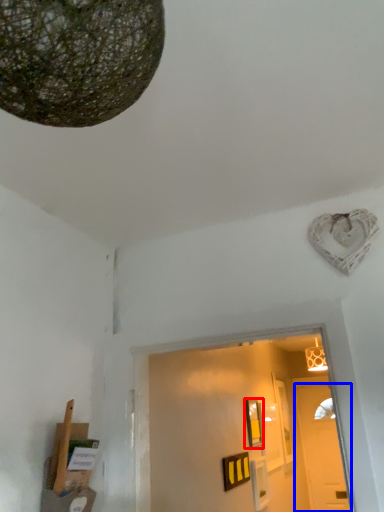
Question: Which object is closer to the camera taking this photo, picture frame (highlighted by a red box) or door (highlighted by a blue box)?

Choices:
 (A) picture frame
 (B) door

Answer: (A)